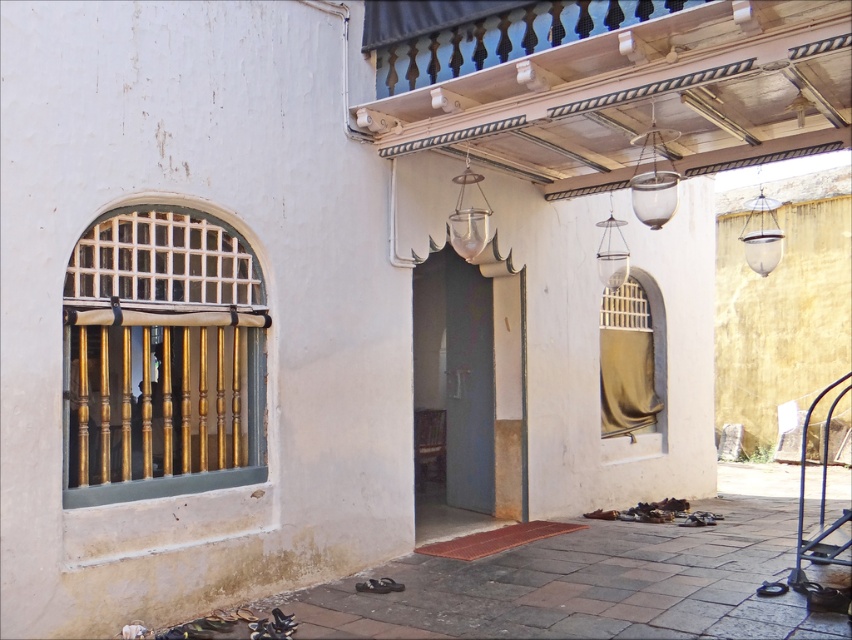
Locate an element on the screen. The image size is (852, 640). smooth concrete floor at lower center is located at coordinates click(x=574, y=586).

This screenshot has height=640, width=852. Identify the location of smooth concrete floor at lower center. (574, 586).

Which is in front, point (818, 76) or point (657, 186)?

Point (818, 76) is in front.

Can you confirm if wooden at upper center is positioned below metallic glass pendant light at upper center?

No, wooden at upper center is not below metallic glass pendant light at upper center.

Locate an element on the screen. wooden at upper center is located at coordinates (619, 86).

In the scene shown: Is metallic glass pendant light at upper center below translucent glass lantern at center?

Incorrect, metallic glass pendant light at upper center is not positioned below translucent glass lantern at center.

Can you confirm if metallic glass pendant light at upper center is positioned to the right of translucent glass lantern at center?

Correct, you'll find metallic glass pendant light at upper center to the right of translucent glass lantern at center.

Between point (672, 164) and point (614, 253), which one is positioned in front?

Point (672, 164)

Where is `metallic glass pendant light at upper center`? Image resolution: width=852 pixels, height=640 pixels. metallic glass pendant light at upper center is located at coordinates (653, 179).